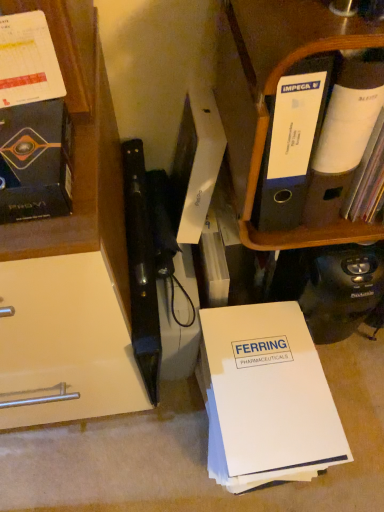
Question: Looking at their shapes, would you say matte black book at left is wider or thinner than black plastic folder at upper right?

Choices:
 (A) thin
 (B) wide

Answer: (A)

Question: From the image's perspective, relative to black plastic folder at upper right, is matte black book at left above or below?

Choices:
 (A) below
 (B) above

Answer: (A)

Question: Based on their relative distances, which object is farther from the matte black book at left?

Choices:
 (A) white paper at center
 (B) black plastic folder at upper right

Answer: (A)

Question: Which object is positioned farthest from the white paper at center?

Choices:
 (A) matte black book at left
 (B) black plastic folder at upper right

Answer: (A)